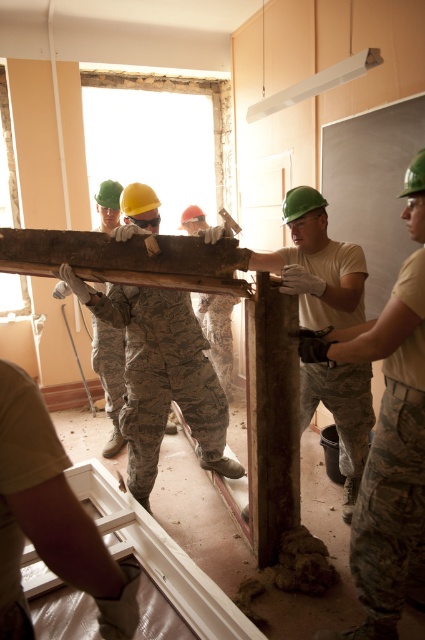
You are a safety inspector in the construction site. You see the matte green helmet at center and the rusty metal pole at center. Which object is smaller in size?

The matte green helmet at center is smaller than the rusty metal pole at center.

You are a safety inspector observing the construction site. You notice the matte green helmet at center and the camouflage fabric uniform at center. Which object is positioned closer to your viewpoint?

The matte green helmet at center is closer to the viewer than the camouflage fabric uniform at center.

You are a safety inspector observing the construction site. You notice the matte green helmet at center and the rusty metal pole at center. According to safety regulations, objects must not be placed above other objects if they could fall and hit someone. Is the current arrangement compliant with safety standards?

The matte green helmet at center is positioned under the rusty metal pole at center, which violates safety regulations because the pole could fall and hit the helmet wearer. The arrangement is not compliant with safety standards.